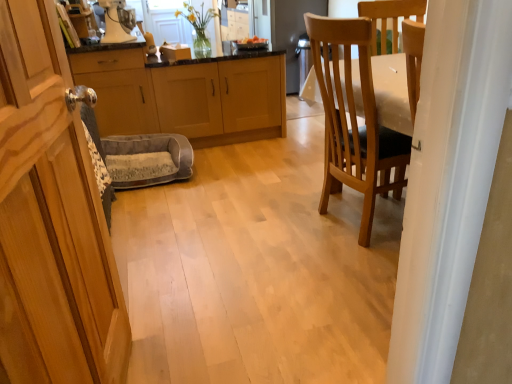
Locate an element on the screen. Image resolution: width=512 pixels, height=384 pixels. wooden cabinet at left, positioned as the 1th cabinetry in front-to-back order is located at coordinates (51, 219).

The image size is (512, 384). What are the coordinates of `white glossy blender at upper center` in the screenshot? It's located at (117, 21).

In order to face white glossy blender at upper center, should I rotate leftwards or rightwards?

To face it directly, rotate left by 17.693 degrees.

In order to face metallic silver cabinet at left, positioned as the second cabinetry in back-to-front order, should I rotate leftwards or rightwards?

Turn left approximately 17.967 degrees to face it.

What do you see at coordinates (118, 88) in the screenshot? The width and height of the screenshot is (512, 384). I see `metallic silver cabinet at left, positioned as the second cabinetry in back-to-front order` at bounding box center [118, 88].

Where is `wooden cabinet at left, which ranks as the third cabinetry in back-to-front order`? wooden cabinet at left, which ranks as the third cabinetry in back-to-front order is located at coordinates (51, 219).

Considering the sizes of objects gray plush pet bed at center and white glossy blender at upper center in the image provided, who is smaller, gray plush pet bed at center or white glossy blender at upper center?

white glossy blender at upper center is smaller.

Considering the sizes of objects gray plush pet bed at center and white glossy blender at upper center in the image provided, who is taller, gray plush pet bed at center or white glossy blender at upper center?

Standing taller between the two is white glossy blender at upper center.

How many degrees apart are the facing directions of gray plush pet bed at center and white glossy blender at upper center?

The angle between the facing direction of gray plush pet bed at center and the facing direction of white glossy blender at upper center is 29.3 degrees.

How much distance is there between gray plush pet bed at center and white glossy blender at upper center?

gray plush pet bed at center is 33.41 inches from white glossy blender at upper center.

Based on the photo, from the image's perspective, is white glossy blender at upper center below wooden chair at right?

No.

Looking at this image, does white glossy blender at upper center turn towards wooden chair at right?

No, white glossy blender at upper center is not aimed at wooden chair at right.

In the scene shown: Does white glossy blender at upper center come in front of wooden chair at right?

No, it is behind wooden chair at right.

Is point (117, 38) positioned in front of point (340, 164)?

No, it is not.

Can you see light wood/finish cabinet at center, acting as the 3th cabinetry starting from the front, touching white glossy blender at upper center?

No, light wood/finish cabinet at center, acting as the 3th cabinetry starting from the front, is not next to white glossy blender at upper center.

Is light wood/finish cabinet at center, the 1th cabinetry when ordered from back to front, taller or shorter than white glossy blender at upper center?

Clearly, light wood/finish cabinet at center, the 1th cabinetry when ordered from back to front, is taller compared to white glossy blender at upper center.

Is light wood/finish cabinet at center, the 1th cabinetry when ordered from back to front, located outside white glossy blender at upper center?

Yes, light wood/finish cabinet at center, the 1th cabinetry when ordered from back to front, is located beyond the bounds of white glossy blender at upper center.

How much distance is there between light wood/finish cabinet at center, the 1th cabinetry when ordered from back to front, and white glossy blender at upper center?

light wood/finish cabinet at center, the 1th cabinetry when ordered from back to front, and white glossy blender at upper center are 72.74 centimeters apart from each other.

Is wooden chair at right next to gray plush pet bed at center and touching it?

No, wooden chair at right is not with gray plush pet bed at center.

Which is closer to the camera, (326, 35) or (129, 165)?

The point (326, 35) is in front.

From the picture: Which object is wider, wooden chair at right or gray plush pet bed at center?

wooden chair at right.

Which of these two, light wood/finish cabinet at center, acting as the 3th cabinetry starting from the front, or gray plush pet bed at center, is bigger?

With larger size is light wood/finish cabinet at center, acting as the 3th cabinetry starting from the front.

Does light wood/finish cabinet at center, the 1th cabinetry when ordered from back to front, turn towards gray plush pet bed at center?

No, light wood/finish cabinet at center, the 1th cabinetry when ordered from back to front, is not turned towards gray plush pet bed at center.

Which is more to the left, light wood/finish cabinet at center, acting as the 3th cabinetry starting from the front, or gray plush pet bed at center?

From the viewer's perspective, gray plush pet bed at center appears more on the left side.

Based on the photo, would you say metallic silver cabinet at left, the second cabinetry viewed from the front, is to the left or to the right of light wood/finish cabinet at center, acting as the 3th cabinetry starting from the front, in the picture?

From the image, it's evident that metallic silver cabinet at left, the second cabinetry viewed from the front, is to the left of light wood/finish cabinet at center, acting as the 3th cabinetry starting from the front.

From the image's perspective, between metallic silver cabinet at left, the second cabinetry viewed from the front, and light wood/finish cabinet at center, acting as the 3th cabinetry starting from the front, who is located below?

light wood/finish cabinet at center, acting as the 3th cabinetry starting from the front, is shown below in the image.

Would you say metallic silver cabinet at left, positioned as the second cabinetry in back-to-front order, is a long distance from light wood/finish cabinet at center, acting as the 3th cabinetry starting from the front?

No, metallic silver cabinet at left, positioned as the second cabinetry in back-to-front order, is not far from light wood/finish cabinet at center, acting as the 3th cabinetry starting from the front.

From a real-world perspective, which is physically below, metallic silver cabinet at left, the second cabinetry viewed from the front, or light wood/finish cabinet at center, acting as the 3th cabinetry starting from the front?

light wood/finish cabinet at center, acting as the 3th cabinetry starting from the front, from a real-world perspective.

From a real-world perspective, which object rests below the other?

metallic silver cabinet at left, the second cabinetry viewed from the front.

Is the surface of metallic silver cabinet at left, positioned as the second cabinetry in back-to-front order, in direct contact with wooden cabinet at left, positioned as the 1th cabinetry in front-to-back order?

No, metallic silver cabinet at left, positioned as the second cabinetry in back-to-front order, is not touching wooden cabinet at left, positioned as the 1th cabinetry in front-to-back order.

Considering the relative sizes of metallic silver cabinet at left, the second cabinetry viewed from the front, and wooden cabinet at left, positioned as the 1th cabinetry in front-to-back order, in the image provided, is metallic silver cabinet at left, the second cabinetry viewed from the front, shorter than wooden cabinet at left, positioned as the 1th cabinetry in front-to-back order,?

Indeed, metallic silver cabinet at left, the second cabinetry viewed from the front, has a lesser height compared to wooden cabinet at left, positioned as the 1th cabinetry in front-to-back order.

From the picture: Which is correct: metallic silver cabinet at left, the second cabinetry viewed from the front, is inside wooden cabinet at left, positioned as the 1th cabinetry in front-to-back order, or outside of it?

metallic silver cabinet at left, the second cabinetry viewed from the front, exists outside the volume of wooden cabinet at left, positioned as the 1th cabinetry in front-to-back order.

Locate an element on the screen. This screenshot has width=512, height=384. rocking chair in front of the white glossy blender at upper center is located at coordinates (147, 159).

Where is `chair below the white glossy blender at upper center (from a real-world perspective)`? chair below the white glossy blender at upper center (from a real-world perspective) is located at coordinates coord(354,119).

From the image, which object appears to be farther from gray plush pet bed at center, wooden cabinet at left, positioned as the 1th cabinetry in front-to-back order, or white glossy blender at upper center?

wooden cabinet at left, positioned as the 1th cabinetry in front-to-back order, is further to gray plush pet bed at center.

Considering their positions, is wooden chair at right positioned further to wooden cabinet at left, which ranks as the third cabinetry in back-to-front order, than gray plush pet bed at center?

gray plush pet bed at center lies further to wooden cabinet at left, which ranks as the third cabinetry in back-to-front order, than the other object.

Considering their positions, is wooden cabinet at left, positioned as the 1th cabinetry in front-to-back order, positioned further to wooden chair at right than gray plush pet bed at center?

The object further to wooden chair at right is gray plush pet bed at center.

When comparing their distances from white glossy blender at upper center, does wooden cabinet at left, positioned as the 1th cabinetry in front-to-back order, or gray plush pet bed at center seem closer?

gray plush pet bed at center is closer to white glossy blender at upper center.

Looking at the image, which one is located closer to white glossy blender at upper center, metallic silver cabinet at left, positioned as the second cabinetry in back-to-front order, or gray plush pet bed at center?

The object closer to white glossy blender at upper center is metallic silver cabinet at left, positioned as the second cabinetry in back-to-front order.

Based on their spatial positions, is light wood/finish cabinet at center, acting as the 3th cabinetry starting from the front, or gray plush pet bed at center closer to white glossy blender at upper center?

The object closer to white glossy blender at upper center is light wood/finish cabinet at center, acting as the 3th cabinetry starting from the front.

Estimate the real-world distances between objects in this image. Which object is further from wooden cabinet at left, positioned as the 1th cabinetry in front-to-back order, gray plush pet bed at center or wooden chair at right?

gray plush pet bed at center is positioned further to the anchor wooden cabinet at left, positioned as the 1th cabinetry in front-to-back order.

From the picture: When comparing their distances from wooden cabinet at left, positioned as the 1th cabinetry in front-to-back order, does metallic silver cabinet at left, the second cabinetry viewed from the front, or gray plush pet bed at center seem further?

metallic silver cabinet at left, the second cabinetry viewed from the front, lies further to wooden cabinet at left, positioned as the 1th cabinetry in front-to-back order, than the other object.

Where is `chair located between wooden cabinet at left, which ranks as the third cabinetry in back-to-front order, and light wood/finish cabinet at center, acting as the 3th cabinetry starting from the front, in the depth direction`? This screenshot has width=512, height=384. chair located between wooden cabinet at left, which ranks as the third cabinetry in back-to-front order, and light wood/finish cabinet at center, acting as the 3th cabinetry starting from the front, in the depth direction is located at coordinates (354, 119).

Where is `rocking chair situated between metallic silver cabinet at left, the second cabinetry viewed from the front, and light wood/finish cabinet at center, acting as the 3th cabinetry starting from the front, from left to right`? The height and width of the screenshot is (384, 512). rocking chair situated between metallic silver cabinet at left, the second cabinetry viewed from the front, and light wood/finish cabinet at center, acting as the 3th cabinetry starting from the front, from left to right is located at coordinates (147, 159).

Locate an element on the screen. Image resolution: width=512 pixels, height=384 pixels. appliance between metallic silver cabinet at left, positioned as the second cabinetry in back-to-front order, and wooden chair at right, in the horizontal direction is located at coordinates (117, 21).

Find the location of `appliance between wooden chair at right and light wood/finish cabinet at center, acting as the 3th cabinetry starting from the front, along the z-axis`. appliance between wooden chair at right and light wood/finish cabinet at center, acting as the 3th cabinetry starting from the front, along the z-axis is located at coordinates (117, 21).